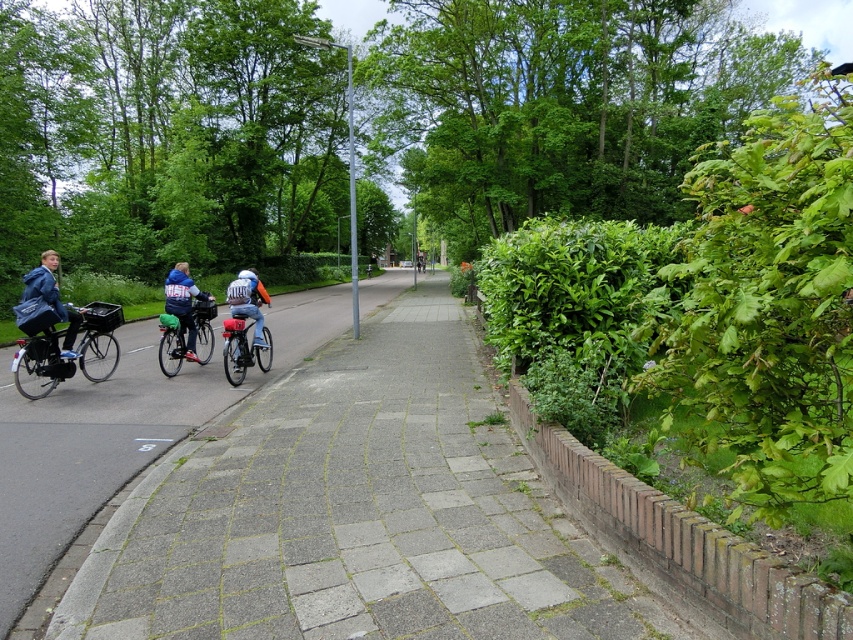
You are standing at the point marked as point (245, 392). If you look straight ahead, can you see the three cyclists on the road? Please explain your reasoning.

The point (245, 392) is 34.95 feet away from the viewer. Since the cyclists are on the road near the viewer, they would likely be visible from that distance unless obstructed by the pathway or greenery. However, the scene description mentions the pathway is lined with lush greenery, which might block the view. Without specific information about obstructions, it is uncertain if the cyclists are visible.

You are a pedestrian standing on the pathway. You see a shiny blue bicycle at center and a blue denim jacket at left. Which object is closer to your right side?

The shiny blue bicycle at center is to the right of blue denim jacket at left, so the shiny blue bicycle at center is closer to your right side.

You are a delivery person who needs to place a small box on the gray concrete pavement at center. The matte black bicycle at left is currently parked near the pavement. Will the box be visible from above if placed on the pavement?

The gray concrete pavement at center is taller than the matte black bicycle at left, so the box placed on the pavement will be higher than the bicycle. Therefore, the box should be visible from above as it is elevated compared to the bicycle.